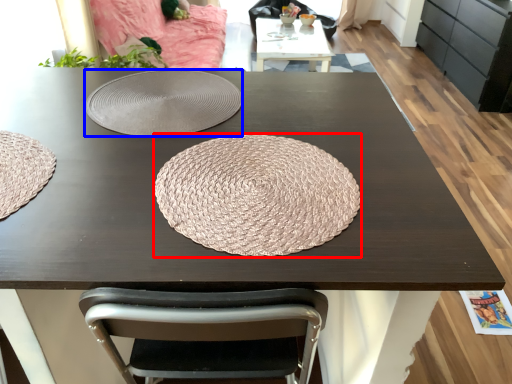
Question: Among these objects, which one is nearest to the camera, mat (highlighted by a red box) or plate (highlighted by a blue box)?

Choices:
 (A) mat
 (B) plate

Answer: (A)